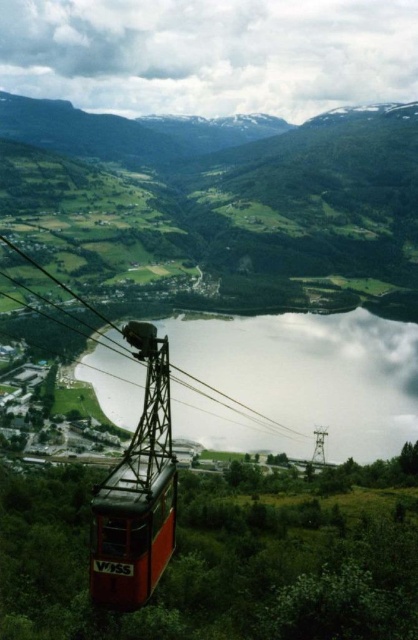
Describe the element at coordinates (211, 54) in the screenshot. I see `white fluffy cloud at upper center` at that location.

Which is more to the left, white fluffy cloud at upper center or metallic cable car at center?

Positioned to the left is white fluffy cloud at upper center.

Does point (96, 108) lie in front of point (165, 538)?

No, it is not.

In order to click on white fluffy cloud at upper center in this screenshot , I will do `click(211, 54)`.

Is white fluffy cloud at upper center shorter than smooth reflective water at center?

Incorrect, white fluffy cloud at upper center's height does not fall short of smooth reflective water at center's.

Based on the photo, is white fluffy cloud at upper center bigger than smooth reflective water at center?

Correct, white fluffy cloud at upper center is larger in size than smooth reflective water at center.

Is point (13, 88) farther from camera compared to point (361, 333)?

Yes, point (13, 88) is farther from viewer.

Locate an element on the screen. Image resolution: width=418 pixels, height=640 pixels. white fluffy cloud at upper center is located at coordinates (211, 54).

Which is below, smooth reflective water at center or metallic cable car at center?

metallic cable car at center is lower down.

Image resolution: width=418 pixels, height=640 pixels. Describe the element at coordinates (297, 381) in the screenshot. I see `smooth reflective water at center` at that location.

What do you see at coordinates (297, 381) in the screenshot? I see `smooth reflective water at center` at bounding box center [297, 381].

Locate an element on the screen. Image resolution: width=418 pixels, height=640 pixels. smooth reflective water at center is located at coordinates (297, 381).